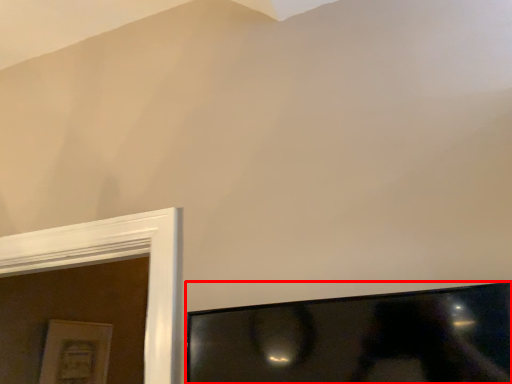
Question: From the image, what is the correct spatial relationship of television (annotated by the red box) in relation to picture frame?

Choices:
 (A) left
 (B) right

Answer: (B)